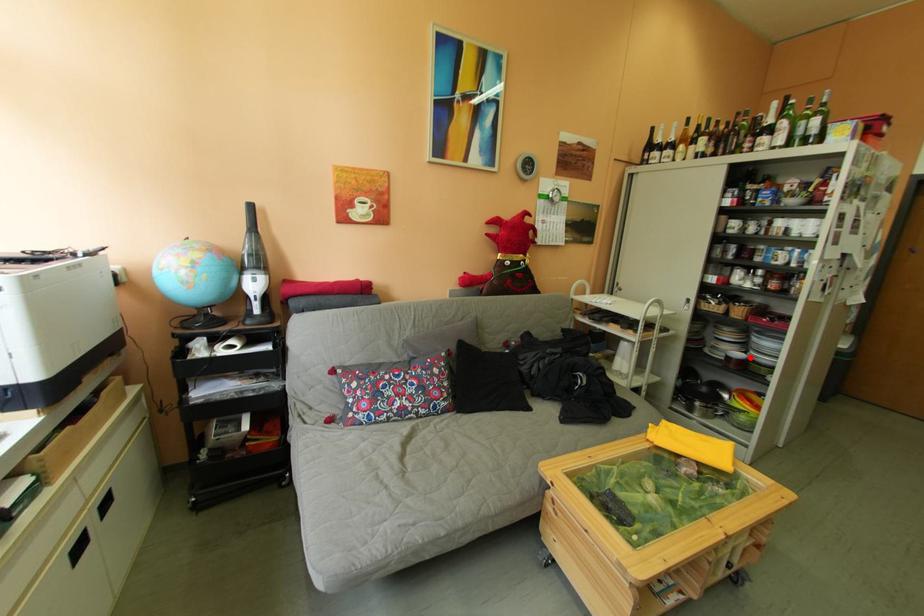
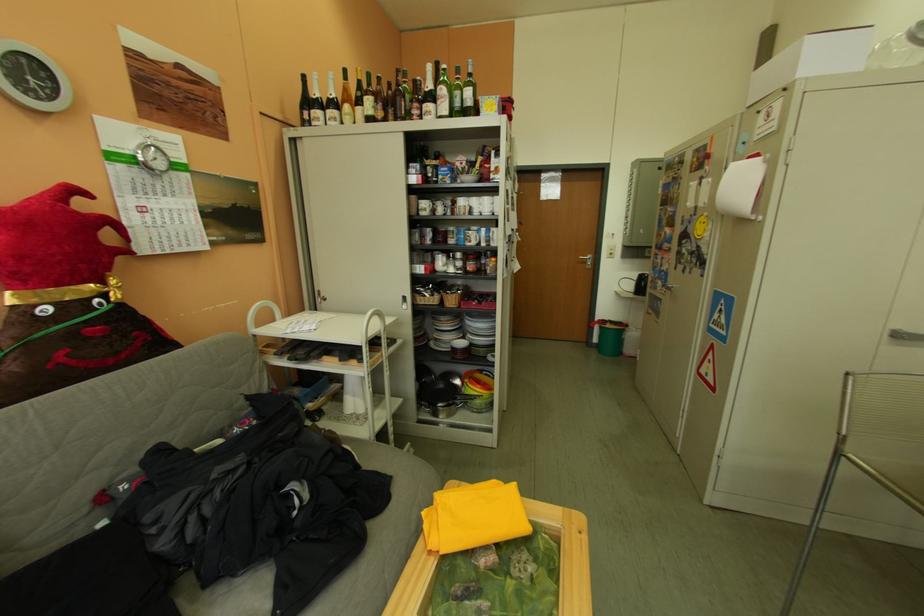
Find the pixel in the second image that matches the highlighted location in the first image.

(473, 346)